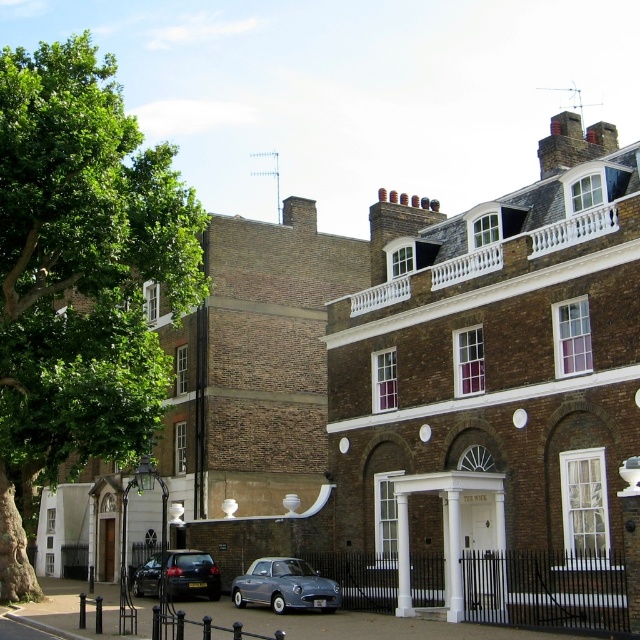
Question: Is metallic blue car at center to the left of matte black car at center from the viewer's perspective?

Choices:
 (A) yes
 (B) no

Answer: (B)

Question: Is green leafy tree at left closer to the viewer compared to metallic blue car at center?

Choices:
 (A) yes
 (B) no

Answer: (B)

Question: Does green leafy tree at left have a lesser width compared to matte black car at center?

Choices:
 (A) yes
 (B) no

Answer: (B)

Question: Which point is farther to the camera?

Choices:
 (A) (314, 598)
 (B) (209, 557)

Answer: (B)

Question: Among these points, which one is nearest to the camera?

Choices:
 (A) (104, 417)
 (B) (216, 592)
 (C) (288, 593)

Answer: (C)

Question: Which object appears closest to the camera in this image?

Choices:
 (A) metallic blue car at center
 (B) green leafy tree at left

Answer: (A)